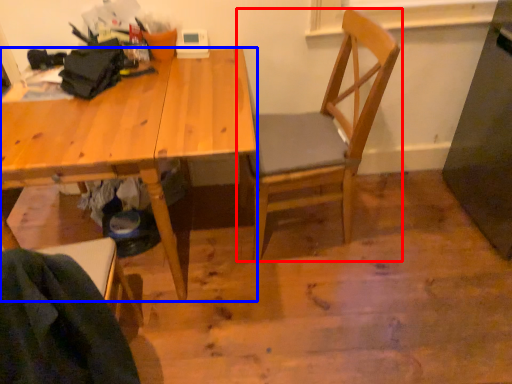
Question: Which object is further to the camera taking this photo, chair (highlighted by a red box) or desk (highlighted by a blue box)?

Choices:
 (A) chair
 (B) desk

Answer: (A)